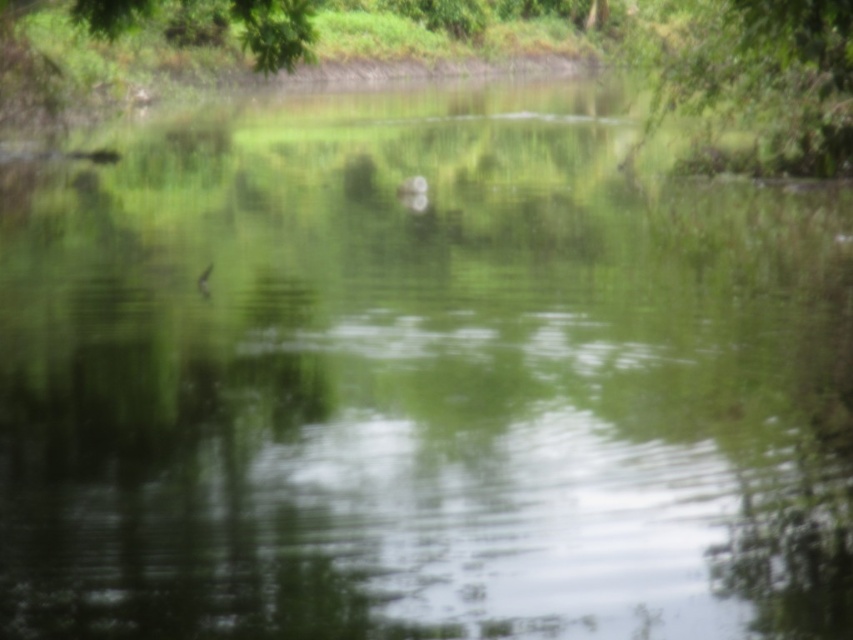
You are an ornithologist observing this natural scene. You notice two green leafy trees in the background. Which tree would cast a longer shadow at noon, the green leafy tree at upper right or the green leafy tree at upper left?

The green leafy tree at upper right has a greater height compared to the green leafy tree at upper left, so it would cast a longer shadow at noon.

You are standing in the middle of the pond looking towards the trees. Which tree, the green leafy tree at upper right or the green leafy tree at upper left, would appear larger to you?

The green leafy tree at upper right would appear larger because it is closer to you than the green leafy tree at upper left.